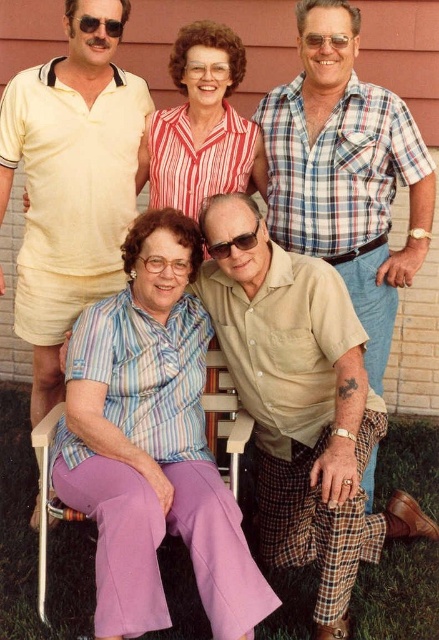
Question: Among these points, which one is nearest to the camera?

Choices:
 (A) (301, 483)
 (B) (427, 218)

Answer: (A)

Question: Does sunglasses at center come in front of sunglasses at upper center?

Choices:
 (A) yes
 (B) no

Answer: (A)

Question: Which of the following is the closest to the observer?

Choices:
 (A) (69, 17)
 (B) (274, 131)
 (C) (319, 49)
 (D) (209, 108)

Answer: (C)

Question: Which of the following is the farthest from the observer?

Choices:
 (A) matte black sunglasses at upper center
 (B) striped cotton blouse at upper center

Answer: (B)

Question: Can you confirm if striped fabric blouse at center is smaller than matte black sunglasses at upper center?

Choices:
 (A) no
 (B) yes

Answer: (A)

Question: Is sunglasses at center to the right of sunglasses at upper center from the viewer's perspective?

Choices:
 (A) no
 (B) yes

Answer: (A)